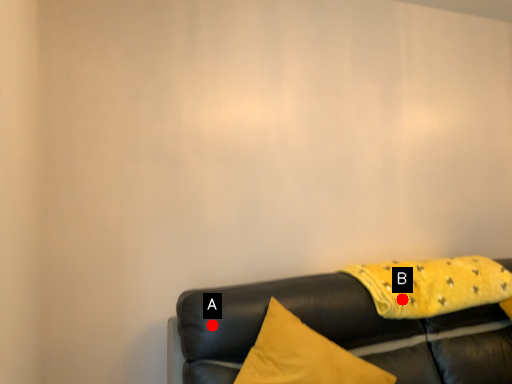
Question: Two points are circled on the image, labeled by A and B beside each circle. Which point is farther to the camera?

Choices:
 (A) A is further
 (B) B is further

Answer: (B)